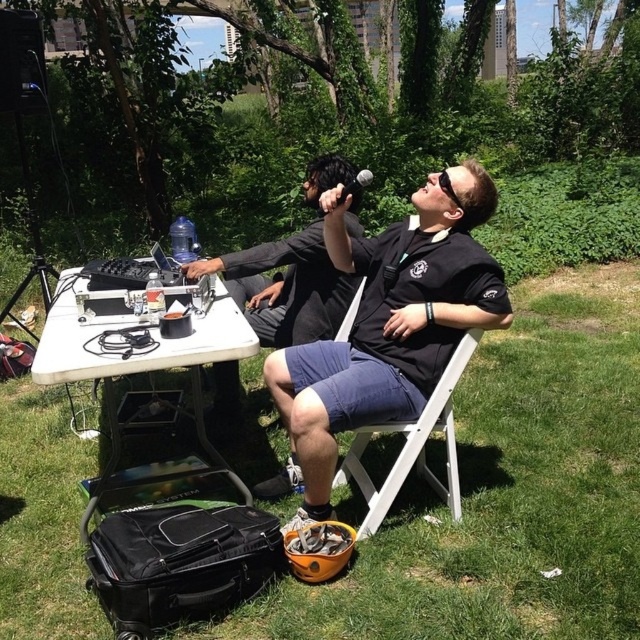
Question: Which point is closer to the camera?

Choices:
 (A) black rubber goggles at upper center
 (B) black matte microphone at upper center
 (C) black matte shirt at center

Answer: (C)

Question: Among these objects, which one is farthest from the camera?

Choices:
 (A) white plastic table at center
 (B) black matte shirt at center

Answer: (B)

Question: Does black matte microphone at upper center lie in front of black rubber goggles at upper center?

Choices:
 (A) no
 (B) yes

Answer: (B)

Question: Which point is closer to the camera?

Choices:
 (A) (346, 188)
 (B) (442, 189)

Answer: (B)

Question: Can you confirm if black matte microphone at upper center is positioned to the right of black rubber goggles at upper center?

Choices:
 (A) yes
 (B) no

Answer: (B)

Question: Does white plastic table at center have a smaller size compared to black rubber goggles at upper center?

Choices:
 (A) no
 (B) yes

Answer: (A)